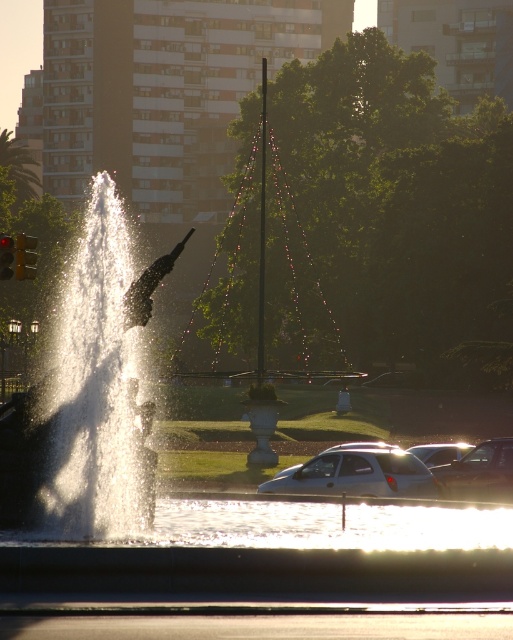
Question: In this image, where is metallic silver sedan at lower right located relative to white glossy car at lower right?

Choices:
 (A) below
 (B) above

Answer: (B)

Question: Does metallic silver sedan at lower right have a lesser width compared to yellow plastic traffic light at left?

Choices:
 (A) no
 (B) yes

Answer: (B)

Question: Estimate the real-world distances between objects in this image. Which object is closer to the red glass traffic light at left?

Choices:
 (A) yellow plastic traffic light at left
 (B) clear water at center
 (C) metallic silver sedan at lower right

Answer: (A)

Question: Which object is the closest to the red glass traffic light at left?

Choices:
 (A) white glossy car at lower right
 (B) metallic silver sedan at lower right

Answer: (A)

Question: Which object is positioned closest to the clear water at center?

Choices:
 (A) yellow plastic traffic light at left
 (B) white matte car at center
 (C) metallic silver sedan at lower right

Answer: (B)

Question: Is clear water at center above white glossy car at lower right?

Choices:
 (A) no
 (B) yes

Answer: (B)